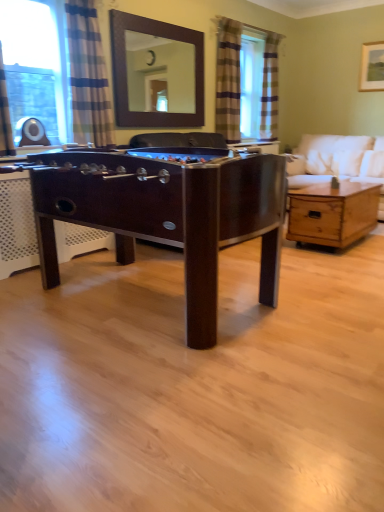
Locate an element on the screen. This screenshot has height=512, width=384. free spot in front of dark wood foosball table at center is located at coordinates (160, 404).